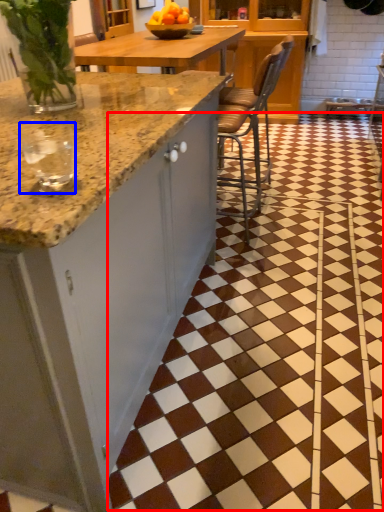
Question: Which of the following is the closest to the observer, tile (highlighted by a red box) or wine glass (highlighted by a blue box)?

Choices:
 (A) tile
 (B) wine glass

Answer: (B)